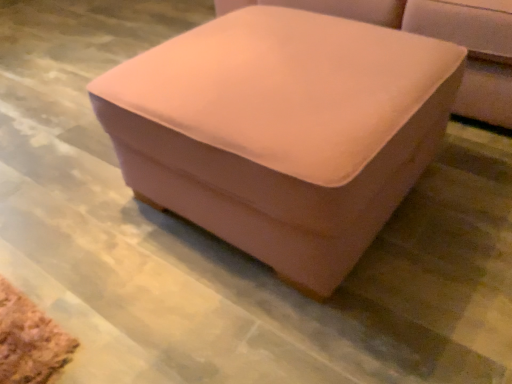
Question: In terms of size, does pink velvet ottoman at center appear bigger or smaller than matte pink ottoman at center?

Choices:
 (A) small
 (B) big

Answer: (A)

Question: Considering their positions, is pink velvet ottoman at center located in front of or behind matte pink ottoman at center?

Choices:
 (A) front
 (B) behind

Answer: (A)

Question: Is pink velvet ottoman at center wider or thinner than matte pink ottoman at center?

Choices:
 (A) thin
 (B) wide

Answer: (A)

Question: Considering the positions of matte pink ottoman at center and pink velvet ottoman at center in the image, is matte pink ottoman at center wider or thinner than pink velvet ottoman at center?

Choices:
 (A) wide
 (B) thin

Answer: (A)

Question: Considering their positions, is matte pink ottoman at center located in front of or behind pink velvet ottoman at center?

Choices:
 (A) behind
 (B) front

Answer: (A)

Question: Is point (495, 86) positioned closer to the camera than point (130, 122)?

Choices:
 (A) farther
 (B) closer

Answer: (A)

Question: From their relative heights in the image, would you say matte pink ottoman at center is taller or shorter than pink velvet ottoman at center?

Choices:
 (A) short
 (B) tall

Answer: (B)